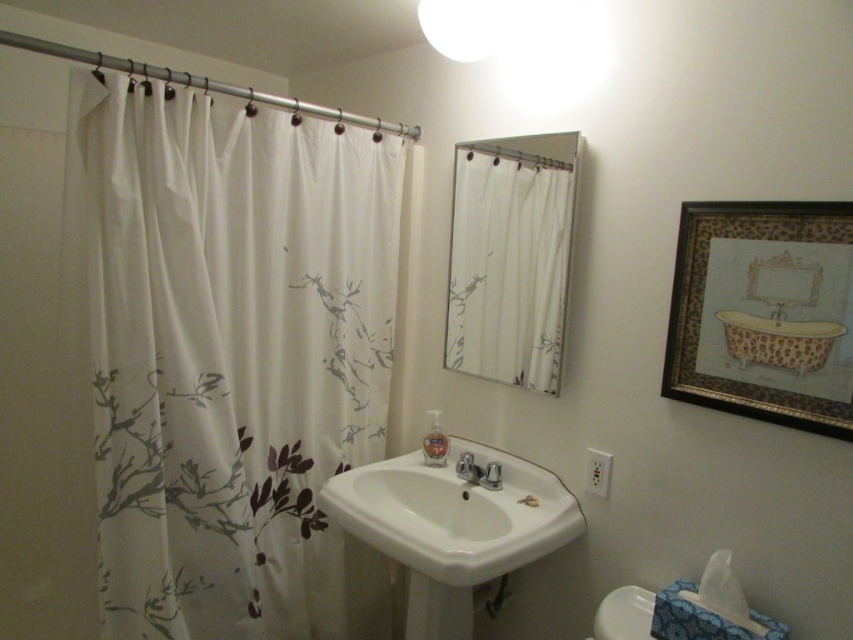
Question: Which point appears closest to the camera in this image?

Choices:
 (A) (611, 609)
 (B) (466, 476)
 (C) (456, 492)
 (D) (204, 125)

Answer: (A)

Question: Does white fabric shower curtain at left have a greater width compared to white glossy sink at center?

Choices:
 (A) no
 (B) yes

Answer: (B)

Question: Is the position of white glossy sink at center more distant than that of white glossy toilet bowl at lower right?

Choices:
 (A) no
 (B) yes

Answer: (B)

Question: Does white glossy sink at center have a lesser width compared to satin nickel faucet at sink center?

Choices:
 (A) no
 (B) yes

Answer: (A)

Question: Which point is farther to the camera?

Choices:
 (A) white glossy sink at center
 (B) satin nickel faucet at sink center

Answer: (B)

Question: Which object is positioned farthest from the satin nickel faucet at sink center?

Choices:
 (A) white fabric shower curtain at left
 (B) white glossy sink at center
 (C) white glossy toilet bowl at lower right

Answer: (A)